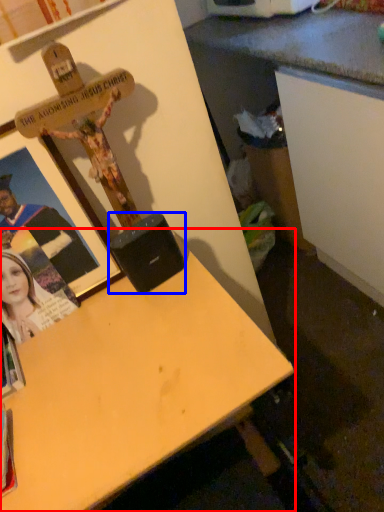
Question: Which object is closer to the camera taking this photo, desk (highlighted by a red box) or speaker (highlighted by a blue box)?

Choices:
 (A) desk
 (B) speaker

Answer: (A)